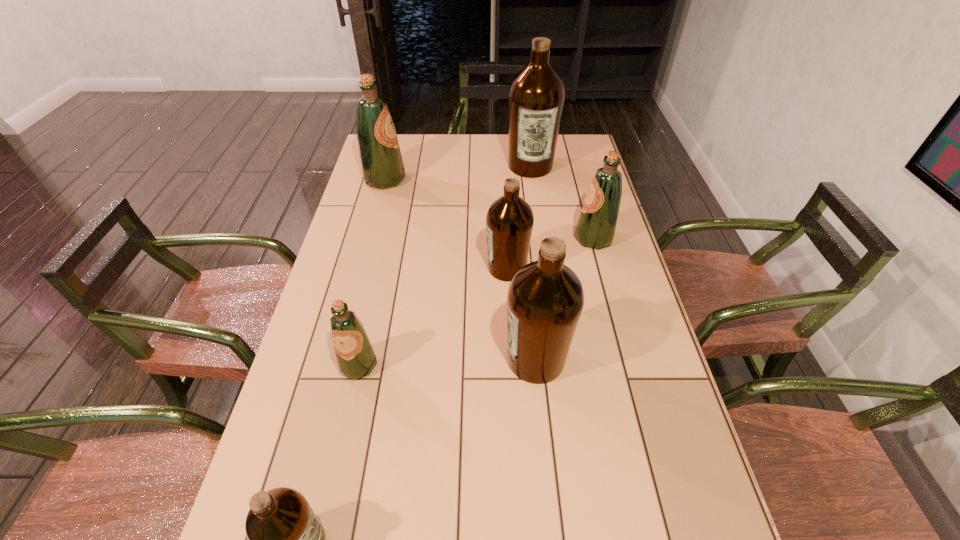
Find the location of `blank space located on the front-facing side of the nearest green olive oil`. blank space located on the front-facing side of the nearest green olive oil is located at coordinates (339, 454).

Find the location of a particular element. The width and height of the screenshot is (960, 540). object present at the far edge is located at coordinates (536, 97).

You are a GUI agent. You are given a task and a screenshot of the screen. Output one action in this format:
    pyautogui.click(x=<x>, y=<y>)
    Task: Click on the object present at the far right corner
    
    Given the screenshot: What is the action you would take?
    pyautogui.click(x=536, y=97)

You are a GUI agent. You are given a task and a screenshot of the screen. Output one action in this format:
    pyautogui.click(x=<x>, y=<y>)
    Task: Click on the free location at the left edge of the desktop
    Image resolution: width=960 pixels, height=540 pixels.
    Given the screenshot: What is the action you would take?
    pyautogui.click(x=373, y=315)

Identify the location of vacant space at the right edge of the desktop. Image resolution: width=960 pixels, height=540 pixels. (x=630, y=266).

This screenshot has height=540, width=960. Identify the location of free space at the far right corner of the desktop. (557, 157).

The image size is (960, 540). Find the location of `free space that is in between the third nearest brown olive oil and the biggest green olive oil`. free space that is in between the third nearest brown olive oil and the biggest green olive oil is located at coordinates (445, 224).

Locate an element on the screen. The height and width of the screenshot is (540, 960). free space that is in between the farthest brown olive oil and the farthest green olive oil is located at coordinates (458, 173).

The width and height of the screenshot is (960, 540). Find the location of `vacant area between the smallest green olive oil and the second nearest brown olive oil`. vacant area between the smallest green olive oil and the second nearest brown olive oil is located at coordinates (447, 362).

Find the location of a particular element. vacant area that lies between the third farthest brown olive oil and the nearest green olive oil is located at coordinates (447, 362).